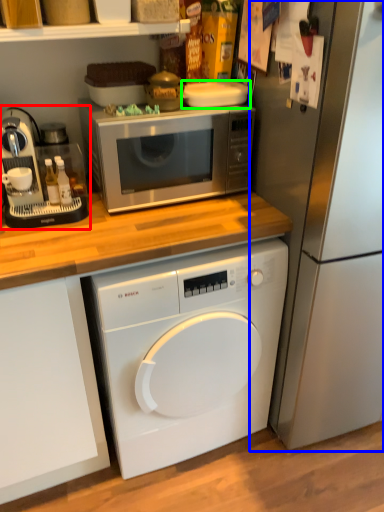
Question: Based on their relative distances, which object is nearer to coffee machine (highlighted by a red box)? Choose from refrigerator (highlighted by a blue box) and appliance (highlighted by a green box).

Choices:
 (A) refrigerator
 (B) appliance

Answer: (B)